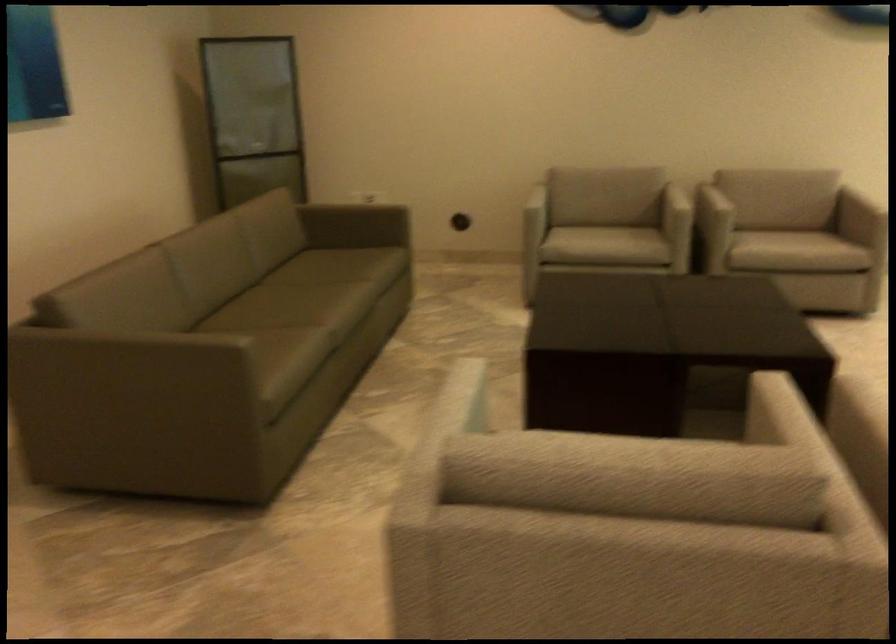
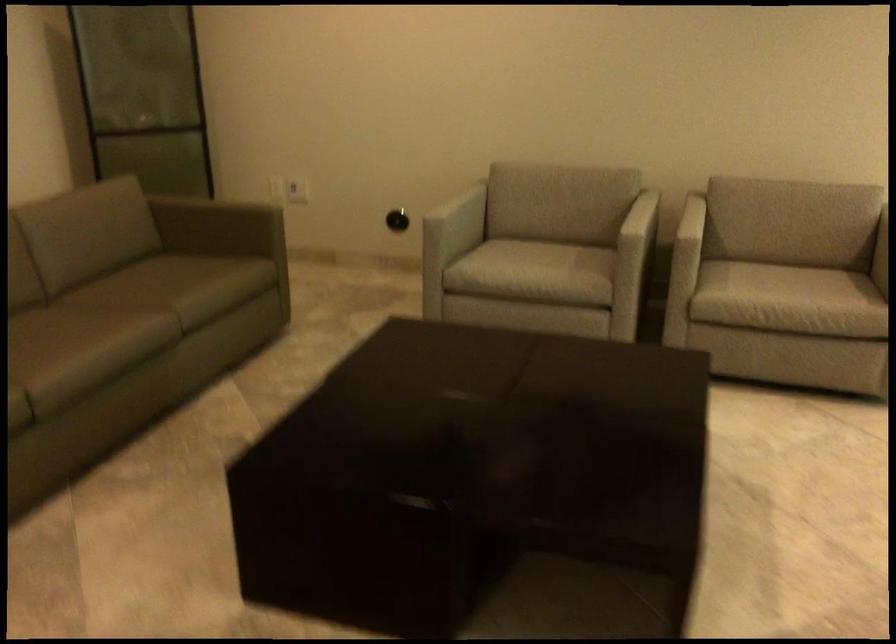
What movement of the cameraman would produce the second image?

The cameraman walked toward right, forward.